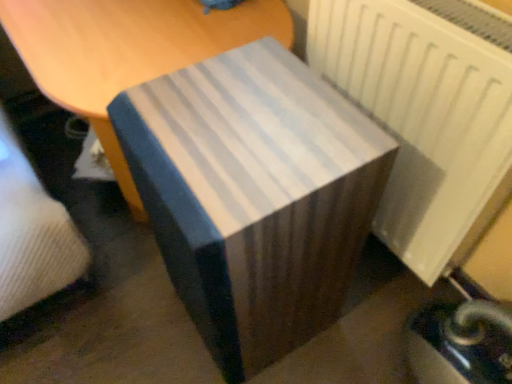
Question: In terms of height, does blue striped fabric at center look taller or shorter compared to white matte radiator at right?

Choices:
 (A) tall
 (B) short

Answer: (A)

Question: In terms of width, does blue striped fabric at center look wider or thinner when compared to white matte radiator at right?

Choices:
 (A) thin
 (B) wide

Answer: (B)

Question: Which object is positioned closest to the blue striped fabric at center?

Choices:
 (A) white matte radiator at right
 (B) white striped fabric at center

Answer: (A)

Question: Estimate the real-world distances between objects in this image. Which object is closer to the white matte radiator at right?

Choices:
 (A) white striped fabric at center
 (B) blue striped fabric at center

Answer: (B)